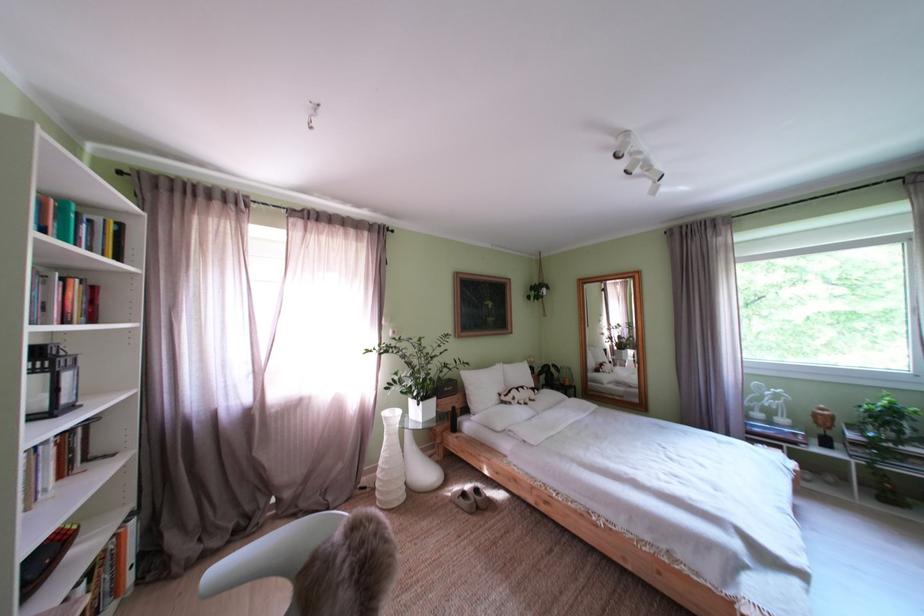
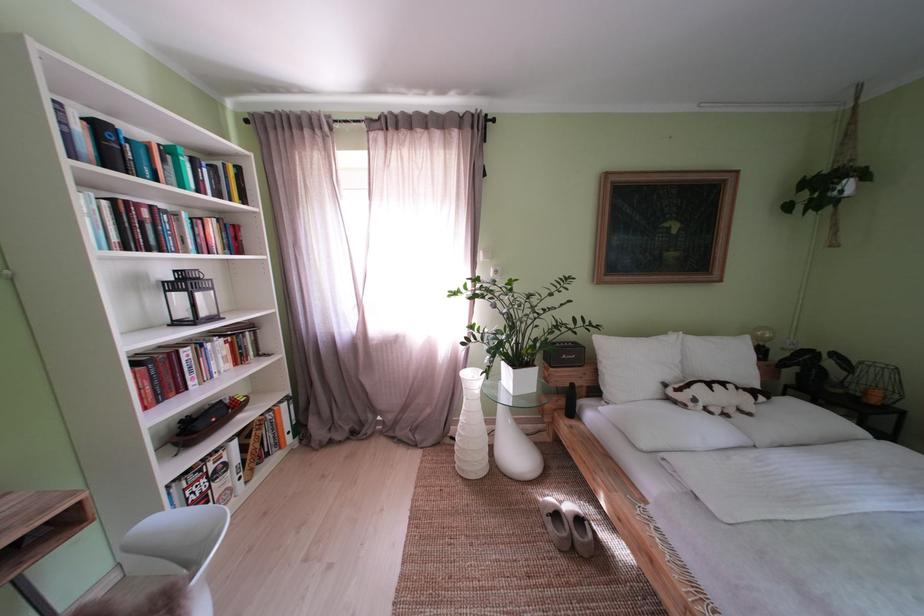
Find the pixel in the second image that matches [492,392] in the first image.

(639, 369)